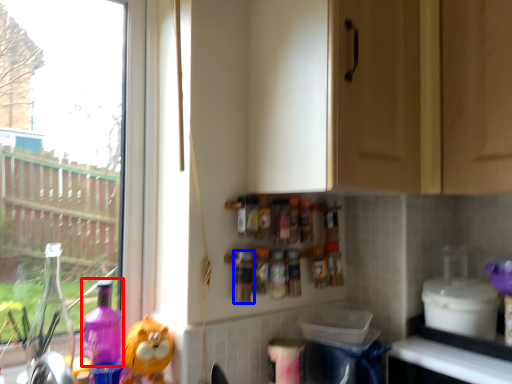
Question: Which object appears farthest to the camera in this image, cleaning product (highlighted by a red box) or bottle (highlighted by a blue box)?

Choices:
 (A) cleaning product
 (B) bottle

Answer: (B)